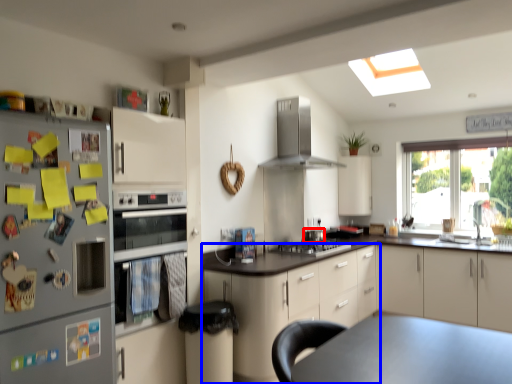
Question: Which object appears closest to the camera in this image, appliance (highlighted by a red box) or cabinetry (highlighted by a blue box)?

Choices:
 (A) appliance
 (B) cabinetry

Answer: (B)